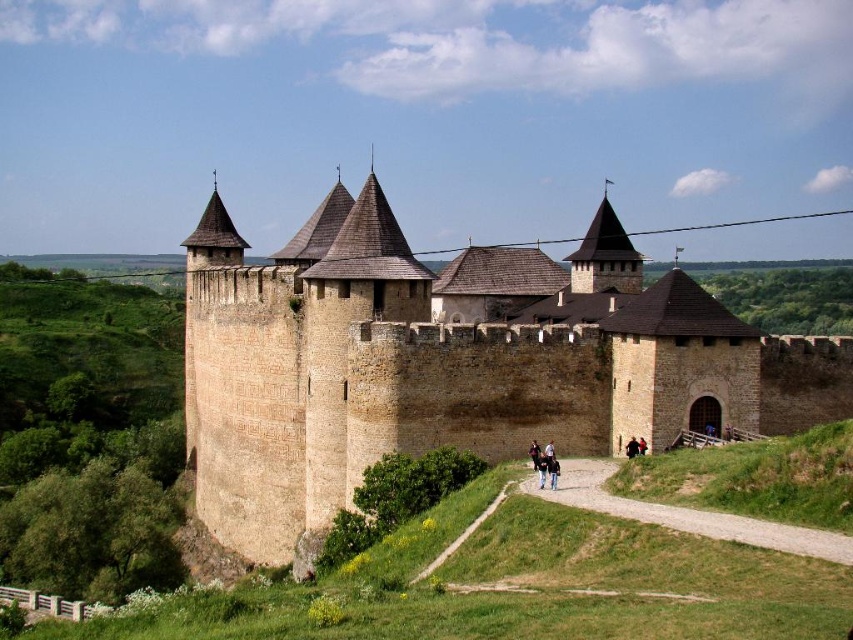
Is dirt/gravel path at center smaller than black leather jacket at center?

No.

Which is more to the right, dirt/gravel path at center or black leather jacket at center?

dirt/gravel path at center is more to the right.

The width and height of the screenshot is (853, 640). Find the location of `dirt/gravel path at center`. dirt/gravel path at center is located at coordinates (688, 515).

Does brown stone castle at center have a larger size compared to black leather jacket at center?

Yes.

Is brown stone castle at center further to camera compared to black leather jacket at center?

Yes.

Which is in front, point (668, 371) or point (537, 467)?

Positioned in front is point (537, 467).

Where is `brown stone castle at center`? Image resolution: width=853 pixels, height=640 pixels. brown stone castle at center is located at coordinates (451, 362).

From the picture: Can you confirm if dirt/gravel path at center is positioned below black fabric person at center?

Correct, dirt/gravel path at center is located below black fabric person at center.

Is point (688, 513) less distant than point (637, 451)?

Yes, it is in front of point (637, 451).

This screenshot has width=853, height=640. What do you see at coordinates (688, 515) in the screenshot? I see `dirt/gravel path at center` at bounding box center [688, 515].

Where is `dirt/gravel path at center`? Image resolution: width=853 pixels, height=640 pixels. dirt/gravel path at center is located at coordinates (688, 515).